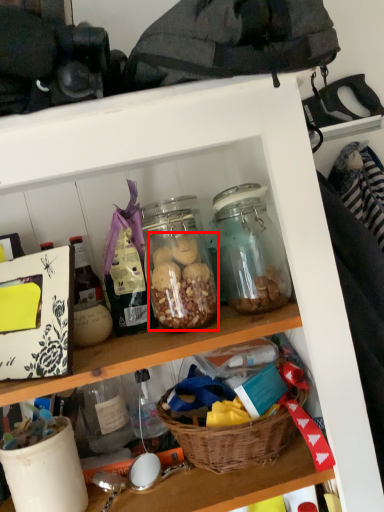
Question: From the image's perspective, where is food (annotated by the red box) located in relation to basket in the image?

Choices:
 (A) below
 (B) above

Answer: (B)